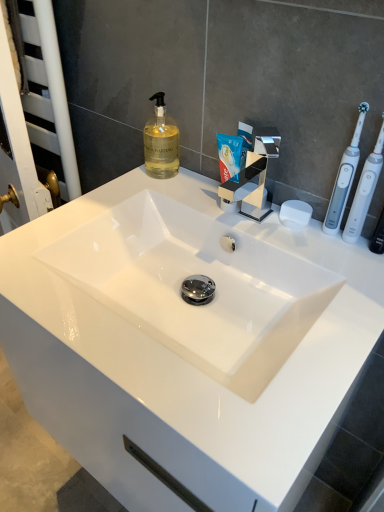
This screenshot has height=512, width=384. I want to click on empty space that is in between white plastic toothbrush at right, the 1th toothbrush when ordered from left to right, and chrome metallic tap at center, so click(x=284, y=234).